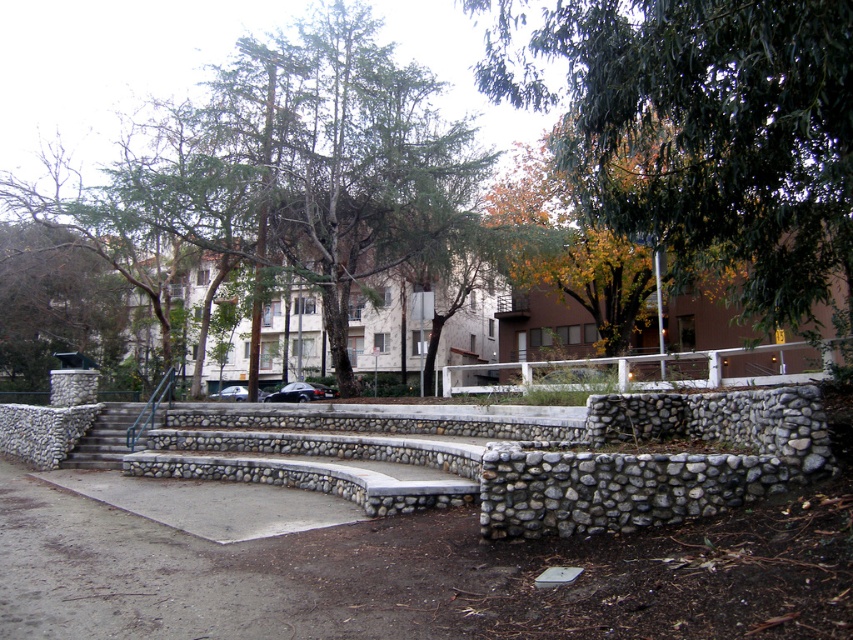
From the picture: You are a maintenance worker who needs to trim the branches of the green leafy tree at upper center. You have a ladder that is 3 meters long. Can you safely reach the branches from the white wooden rail at center without needing a taller ladder?

The distance between the green leafy tree at upper center and the white wooden rail at center is 3.55 meters. Since the ladder is only 3 meters long, it is not long enough to safely reach the branches from the rail. A taller ladder would be required.

Based on the photo, you are standing at the entrance of the park and want to take a photo of the green leafy tree at upper center. Which direction should you face to ensure the tree is in the center of your camera view?

The green leafy tree at upper center is located at point coordinates, so you should face the upper center direction to have it centered in your camera view.

You are a painter who needs to place a 1.2 meter wide canvas between the white wooden rail at center and the gray concrete stairs at center. Can the space between them accommodate the canvas?

The white wooden rail at center is wider than the gray concrete stairs at center. However, the exact distance between them isn